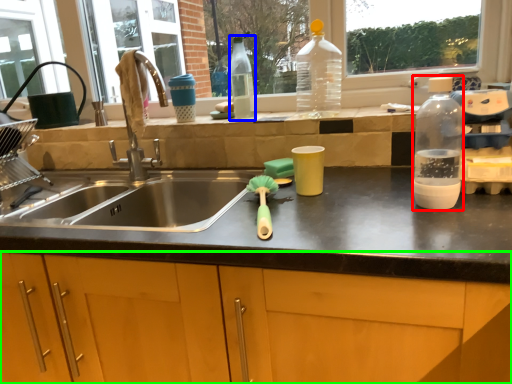
Question: Considering the real-world distances, which object is farthest from bottle (highlighted by a red box)? bottle (highlighted by a blue box) or cabinetry (highlighted by a green box)?

Choices:
 (A) bottle
 (B) cabinetry

Answer: (A)